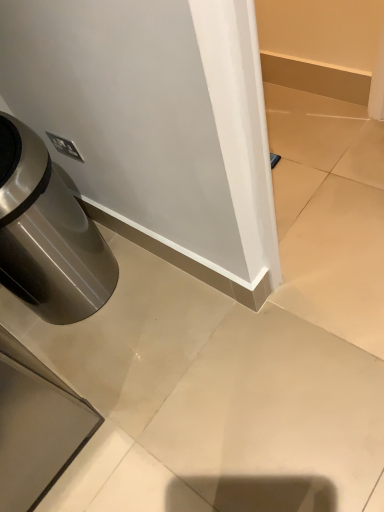
Question: Would you say white glossy baseboard at center is to the left or to the right of brushed metal trash can at lower left in the picture?

Choices:
 (A) left
 (B) right

Answer: (B)

Question: Relative to brushed metal trash can at lower left, is white glossy baseboard at center in front or behind?

Choices:
 (A) behind
 (B) front

Answer: (B)

Question: From their relative heights in the image, would you say white glossy baseboard at center is taller or shorter than brushed metal trash can at lower left?

Choices:
 (A) short
 (B) tall

Answer: (A)

Question: Based on their sizes in the image, would you say brushed metal trash can at lower left is bigger or smaller than white glossy baseboard at center?

Choices:
 (A) big
 (B) small

Answer: (A)

Question: Which is correct: brushed metal trash can at lower left is inside white glossy baseboard at center, or outside of it?

Choices:
 (A) inside
 (B) outside

Answer: (B)

Question: From the image's perspective, is brushed metal trash can at lower left located above or below white glossy baseboard at center?

Choices:
 (A) below
 (B) above

Answer: (B)

Question: Is point (19, 166) closer or farther from the camera than point (374, 375)?

Choices:
 (A) closer
 (B) farther

Answer: (A)